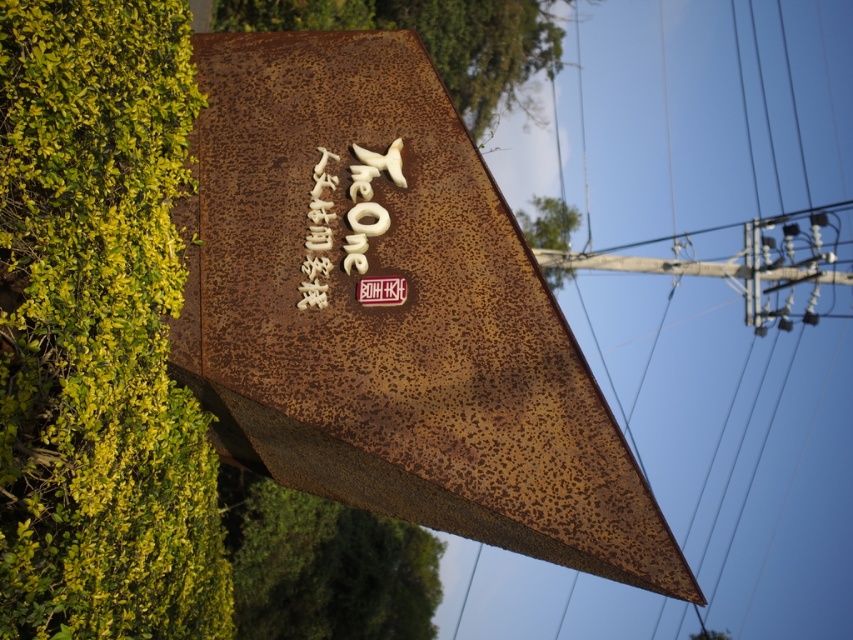
You are standing in front of the rusted triangular signboard. There are two points marked on the signboard at coordinates point (521, 538) and point (308, 529). Which point is closer to you?

Point (521, 538) is closer to the camera than point (308, 529), so the point closer to you is point (521, 538).

Looking at this image, you are a gardener assessing the green leafy hedge at left and the green leafy hedge at lower left in the scene. Which hedge requires more pruning to achieve a balanced appearance?

The green leafy hedge at left requires more pruning since it is thinner than the green leafy hedge at lower left, which is thicker and needs less pruning for balance.